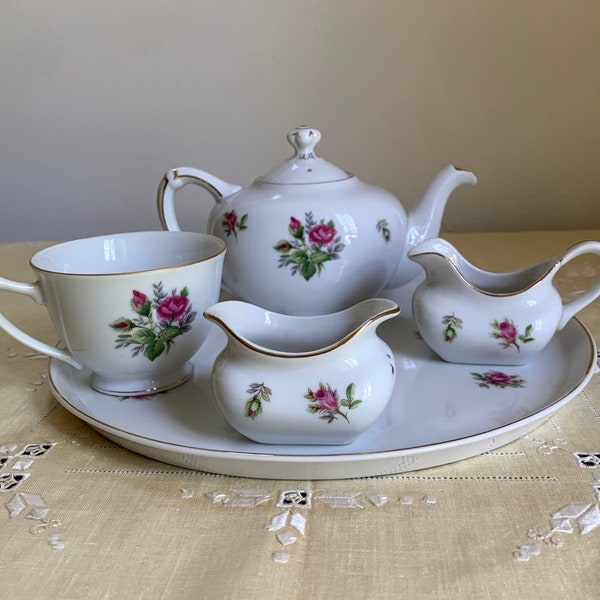
I want to click on table, so click(x=124, y=538).